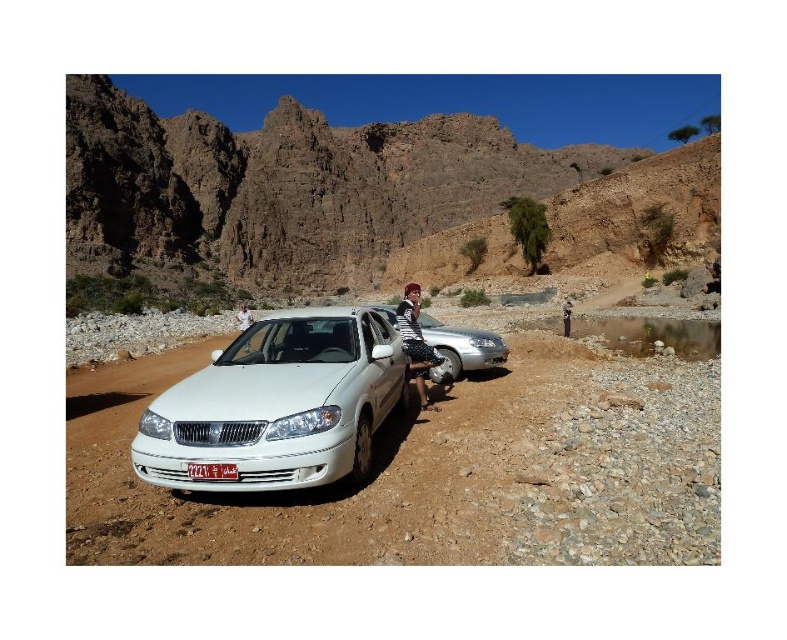
Question: In this image, where is silver metallic car at center located relative to striped fabric shirt at center?

Choices:
 (A) above
 (B) below

Answer: (B)

Question: Among these objects, which one is nearest to the camera?

Choices:
 (A) brown leather jacket at lower right
 (B) white plastic license plate at center

Answer: (B)

Question: Does silver metallic car at center have a greater width compared to striped fabric shirt at center?

Choices:
 (A) no
 (B) yes

Answer: (B)

Question: Is smooth gravel dirt at center smaller than silver metallic car at center?

Choices:
 (A) yes
 (B) no

Answer: (B)

Question: Which point appears farthest from the camera in this image?

Choices:
 (A) (564, 316)
 (B) (416, 381)
 (C) (501, 356)

Answer: (A)

Question: Which object is positioned farthest from the smooth gravel dirt at center?

Choices:
 (A) white glossy sedan at center
 (B) striped fabric shirt at center
 (C) white plastic license plate at center
 (D) silver metallic car at center

Answer: (B)